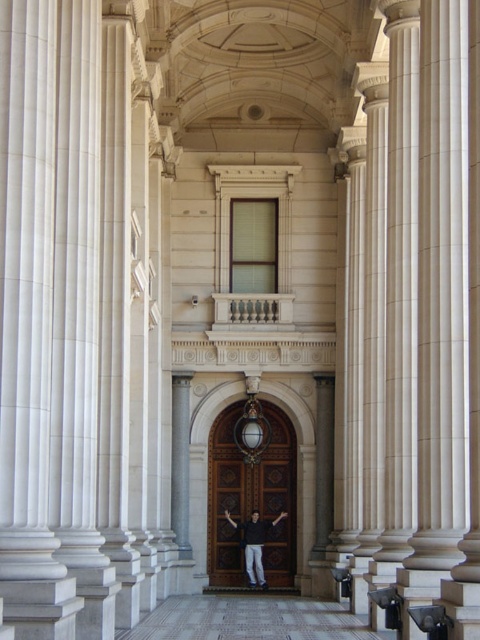
Question: Can you confirm if polished wood door at center is positioned to the right of dark gray shirt at center?

Choices:
 (A) yes
 (B) no

Answer: (B)

Question: From the image, what is the correct spatial relationship of polished wood door at center in relation to dark gray shirt at center?

Choices:
 (A) below
 (B) above

Answer: (B)

Question: Is polished wood door at center above dark gray shirt at center?

Choices:
 (A) no
 (B) yes

Answer: (B)

Question: Among these points, which one is farthest from the camera?

Choices:
 (A) click(249, 582)
 (B) click(208, 480)

Answer: (B)

Question: Which object appears closest to the camera in this image?

Choices:
 (A) dark gray shirt at center
 (B) polished wood door at center

Answer: (A)